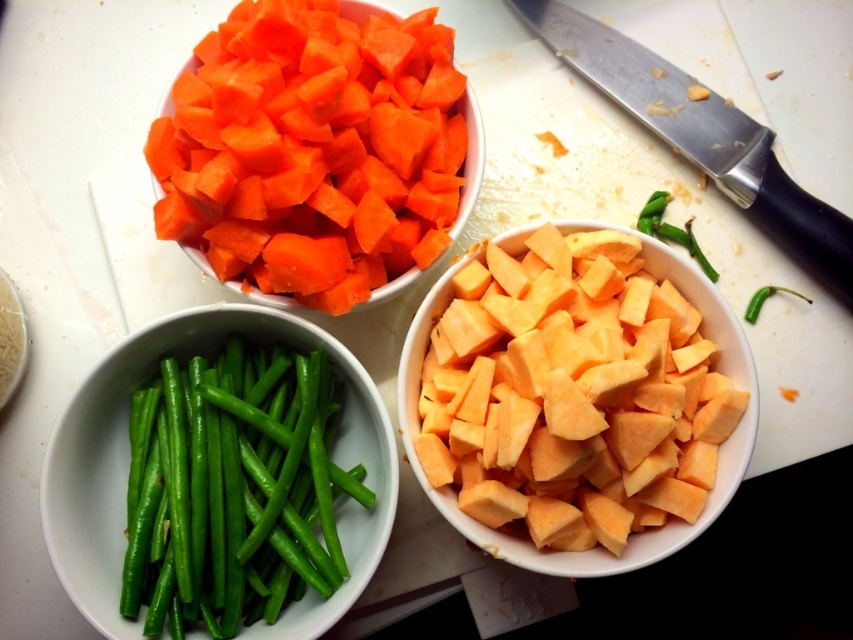
You are organizing the bowls on the kitchen countertop. Which bowl, the orange matte sweet potato at center or the orange matte carrot at upper left, is located higher up?

The orange matte carrot at upper left is higher up because it is positioned above the orange matte sweet potato at center.

You are organizing a food safety inspection and need to check the storage positions of the green smooth beans at center and the green smooth skin pepper at upper right. According to the scene, which object is placed above the other?

The green smooth beans at center is positioned under green smooth skin pepper at upper right, so the green smooth skin pepper at upper right is placed above the green smooth beans at center.

You are a chef holding a 100 cm long ruler. You want to measure the distance between the orange matte sweet potato at center and the camera. Can you reach the distance with your ruler?

The orange matte sweet potato at center and camera are 86.46 centimeters apart from each other. Since the ruler is 100 cm long, the chef can reach the distance between the orange matte sweet potato at center and the camera with the ruler.